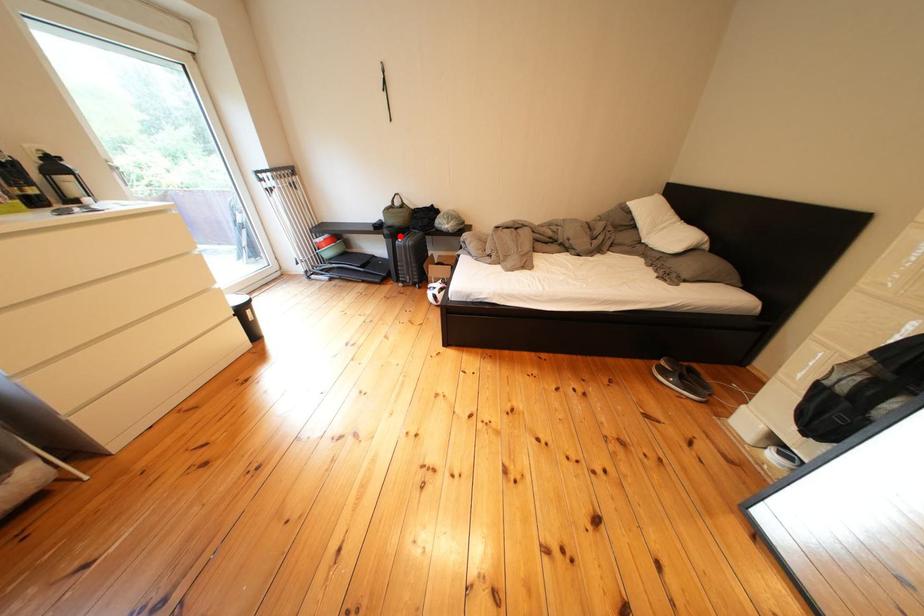
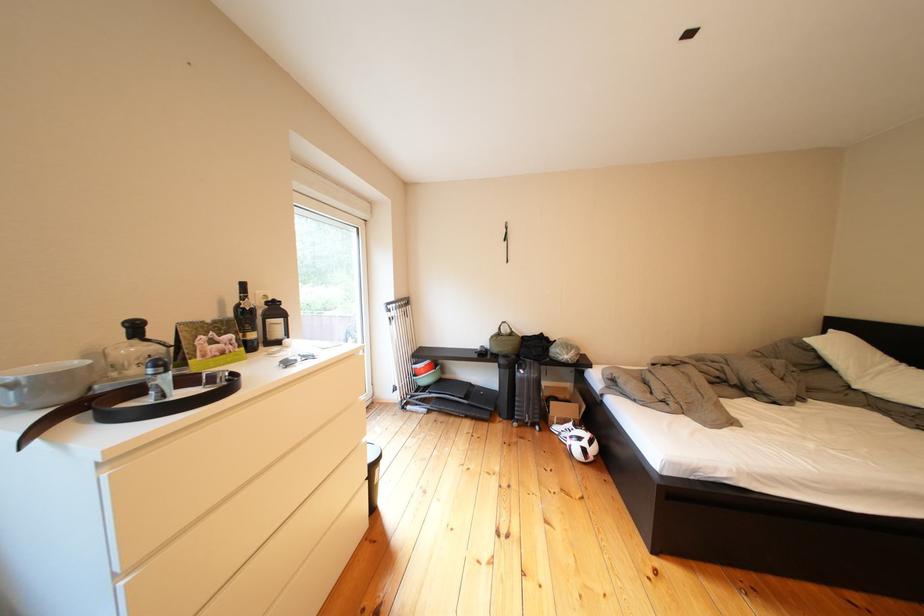
Where in the second image is the point corresponding to the highlighted location from the first image?

(516, 366)